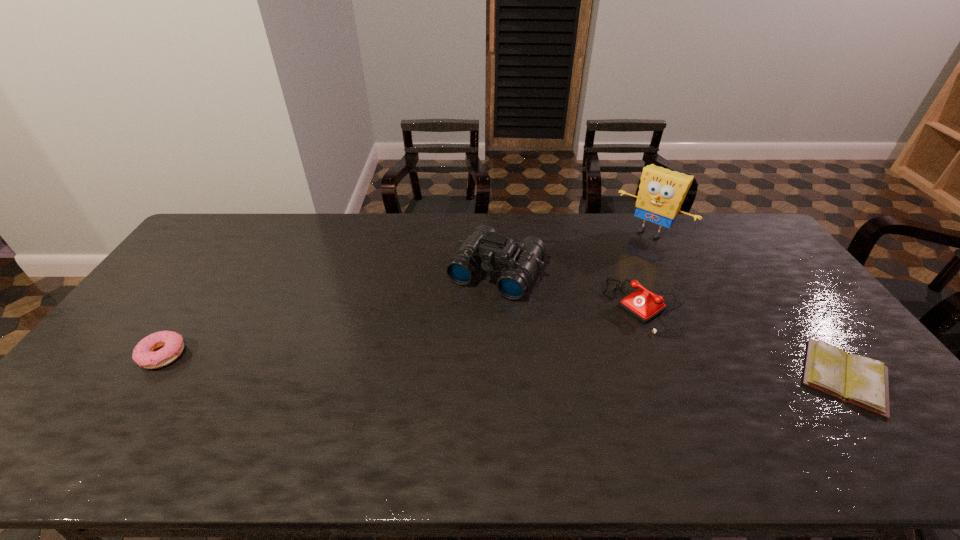
Image resolution: width=960 pixels, height=540 pixels. I want to click on free point between the binoculars and the second shortest object, so click(x=330, y=313).

This screenshot has height=540, width=960. I want to click on free space between the binoculars and the doughnut, so click(330, 313).

This screenshot has height=540, width=960. I want to click on free space between the telephone and the fourth tallest object, so tap(404, 330).

The width and height of the screenshot is (960, 540). What are the coordinates of `unoccupied area between the second tallest object and the leftmost object` in the screenshot? It's located at (330, 313).

What are the coordinates of `free space between the third shortest object and the shortest object` in the screenshot? It's located at (745, 342).

Where is `vacant space in between the leftmost object and the second tallest object`? vacant space in between the leftmost object and the second tallest object is located at coordinates point(330,313).

Find the location of a particular element. The width and height of the screenshot is (960, 540). vacant area that lies between the binoculars and the third tallest object is located at coordinates (571, 289).

Locate an element on the screen. free spot between the tallest object and the telephone is located at coordinates (648, 269).

Where is `vacant point located between the fourth tallest object and the shortest object`? vacant point located between the fourth tallest object and the shortest object is located at coordinates (504, 366).

Identify the location of vacant area that lies between the doughnut and the diary. Image resolution: width=960 pixels, height=540 pixels. (504, 366).